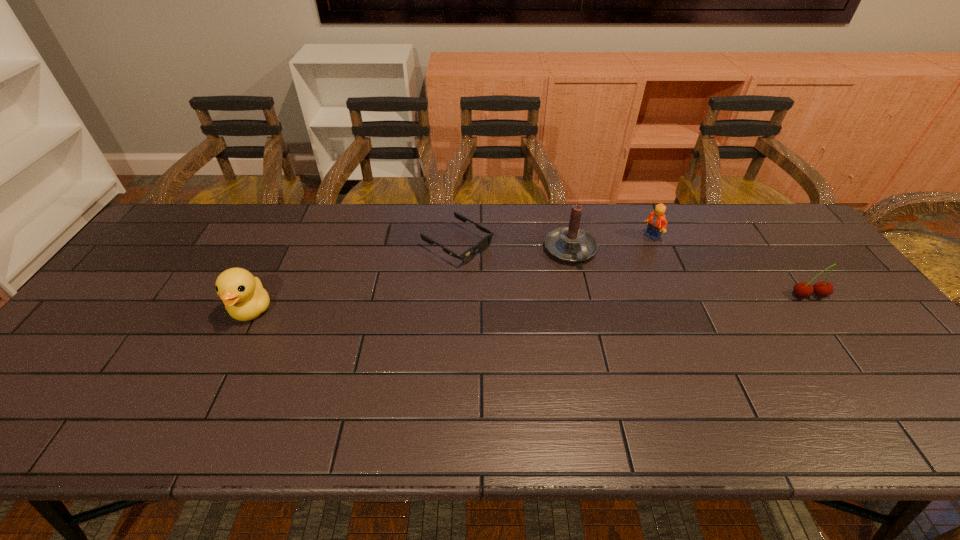
This screenshot has height=540, width=960. What are the coordinates of `vacant region located 0.220m on the temples of the shortest object` in the screenshot? It's located at (546, 296).

This screenshot has height=540, width=960. Identify the location of vacant space located 0.110m on the front-facing side of the second object from right to left. (637, 262).

Locate an element on the screen. This screenshot has height=540, width=960. free space located 0.330m on the front-facing side of the second object from right to left is located at coordinates (609, 308).

Image resolution: width=960 pixels, height=540 pixels. Identify the location of vacant area located on the front-facing side of the second object from right to left. (619, 290).

The image size is (960, 540). I want to click on free location located on the side of the candle with the handle loop, so click(x=600, y=306).

I want to click on vacant space located 0.350m on the side of the candle with the handle loop, so click(636, 371).

Identify the location of free location located 0.280m on the side of the candle with the handle loop. The image size is (960, 540). (623, 347).

Identify the location of sunglasses that is at the far edge. (467, 256).

Identify the location of Lego at the far edge. (657, 223).

Locate an element on the screen. candle that is at the far edge is located at coordinates (571, 244).